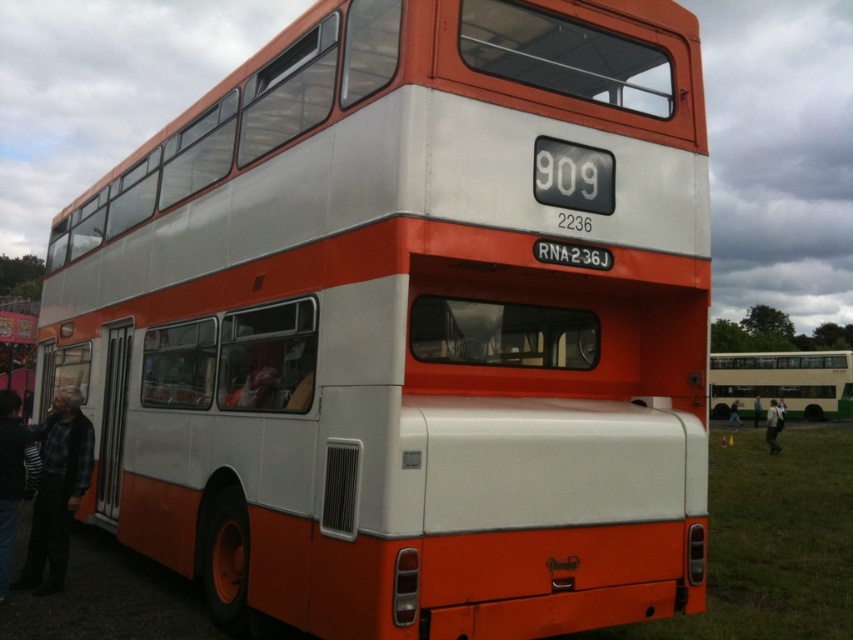
Does beige fabric bus at center appear on the left side of dark gray sweater at lower left?

No, beige fabric bus at center is not to the left of dark gray sweater at lower left.

Which of these two, beige fabric bus at center or dark gray sweater at lower left, stands taller?

With more height is beige fabric bus at center.

The height and width of the screenshot is (640, 853). Find the location of `beige fabric bus at center`. beige fabric bus at center is located at coordinates (782, 381).

Does point (781, 365) come farther from viewer compared to point (753, 420)?

Yes.

This screenshot has width=853, height=640. Identify the location of beige fabric bus at center. (782, 381).

Does white fabric shirt at lower right have a larger size compared to light blue jeans at lower right?

Yes.

Between white fabric shirt at lower right and light blue jeans at lower right, which one appears on the right side from the viewer's perspective?

From the viewer's perspective, light blue jeans at lower right appears more on the right side.

Find the location of `white fabric shirt at lower right`. white fabric shirt at lower right is located at coordinates (773, 426).